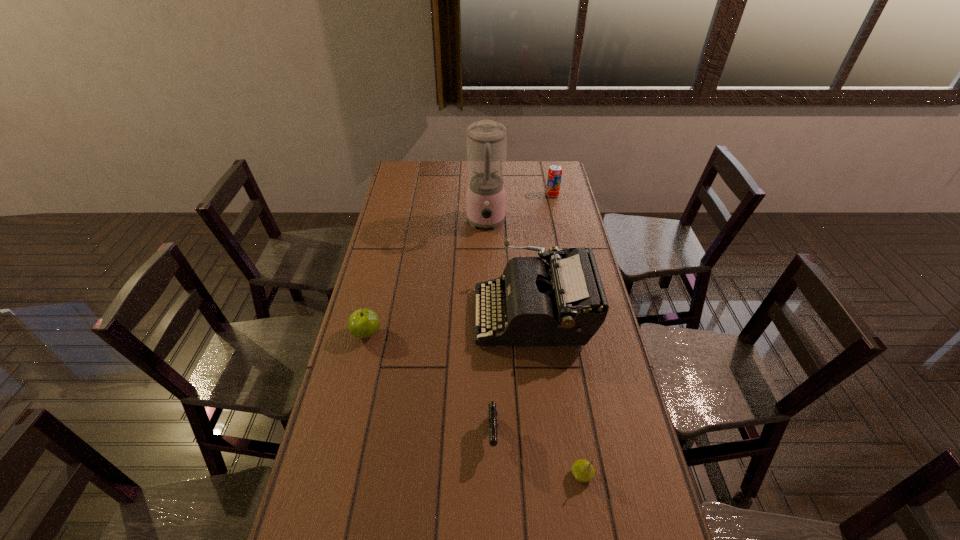
This screenshot has height=540, width=960. Identify the location of pear positioned at the right edge. (583, 471).

Locate an element on the screen. vacant space at the far edge of the desktop is located at coordinates (435, 174).

Locate an element on the screen. This screenshot has height=540, width=960. vacant space at the left edge of the desktop is located at coordinates (342, 444).

You are a GUI agent. You are given a task and a screenshot of the screen. Output one action in this format:
    pyautogui.click(x=<x>, y=<y>)
    Task: Click on the blank area at the right edge
    This screenshot has height=540, width=960.
    Given the screenshot: What is the action you would take?
    pyautogui.click(x=568, y=221)

This screenshot has height=540, width=960. Identify the location of free region at the far right corner. (537, 183).

You are a GUI agent. You are given a task and a screenshot of the screen. Output one action in this format:
    pyautogui.click(x=<x>, y=<y>)
    Task: Click on the vacant area between the tallest object and the leftmost object
    The image size is (960, 540).
    Given the screenshot: What is the action you would take?
    pyautogui.click(x=426, y=278)

Locate an element on the screen. The image size is (960, 540). vacant space that is in between the nearest object and the leftmost object is located at coordinates (474, 404).

Where is `free space between the farthest object and the leftmost object`? The image size is (960, 540). free space between the farthest object and the leftmost object is located at coordinates (460, 264).

What are the coordinates of `free spot between the nearest object and the apple` in the screenshot? It's located at (474, 404).

Find the location of `vacant point located between the pear and the typewriter`. vacant point located between the pear and the typewriter is located at coordinates (558, 395).